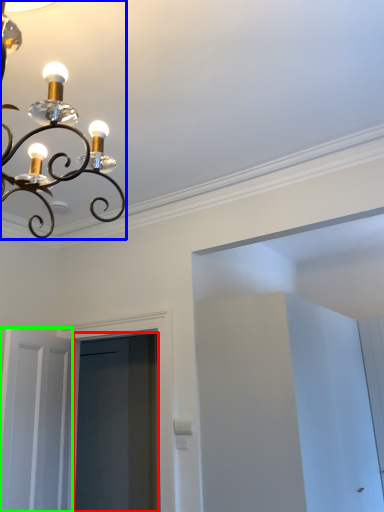
Question: Which is nearer to the screen door (highlighted by a red box)? lamp (highlighted by a blue box) or door (highlighted by a green box).

Choices:
 (A) lamp
 (B) door

Answer: (B)